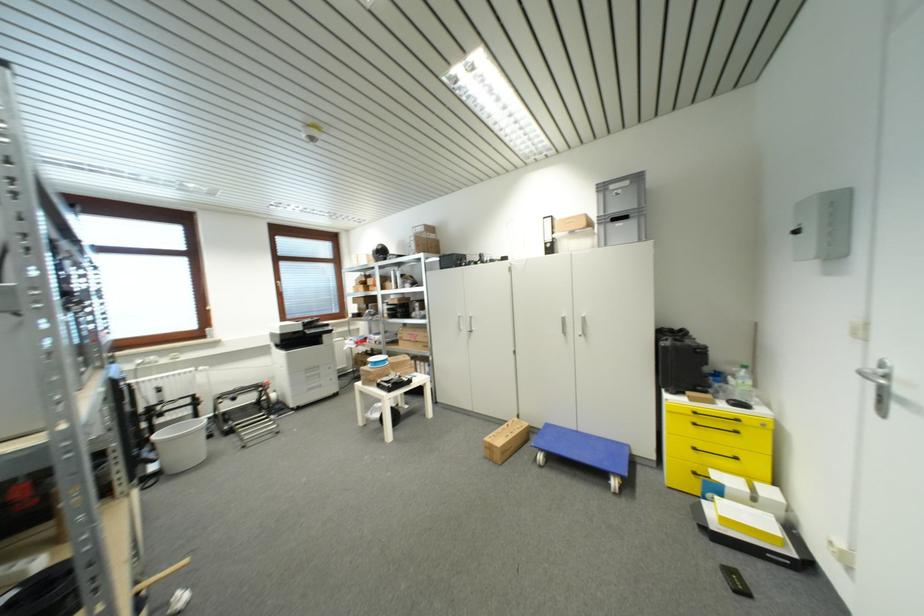
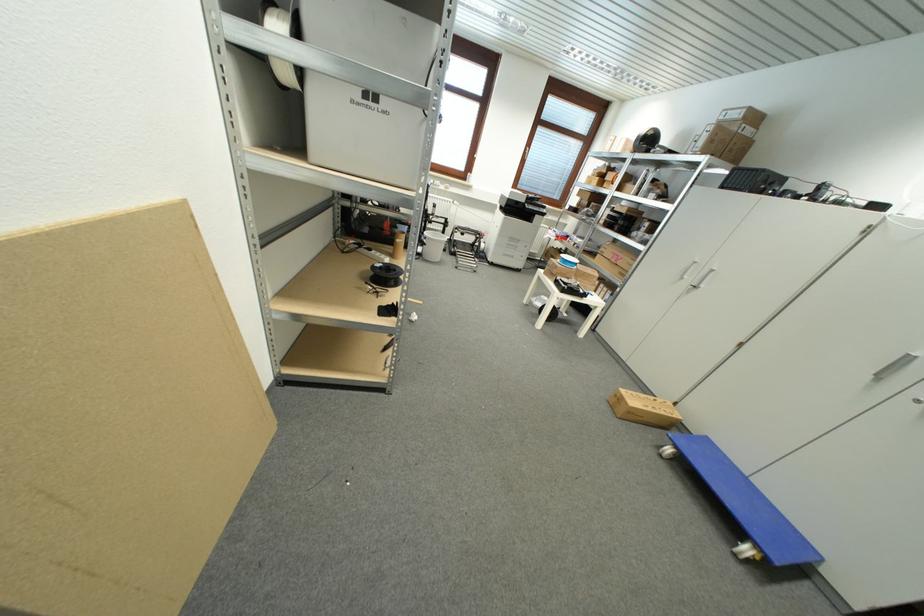
Where in the second image is the point corresponding to point (426, 232) from the first image?

(742, 116)